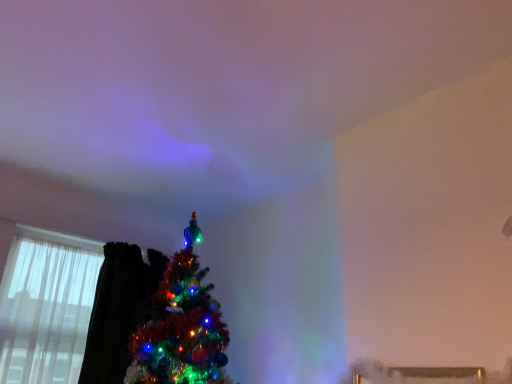
Question: Should I look upward or downward to see transparent curtain at left?

Choices:
 (A) down
 (B) up

Answer: (A)